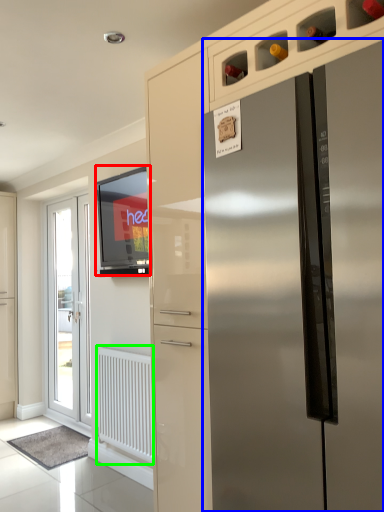
Question: Which is farther away from window screen (highlighted by a red box)? refrigerator (highlighted by a blue box) or radiator (highlighted by a green box)?

Choices:
 (A) refrigerator
 (B) radiator

Answer: (A)